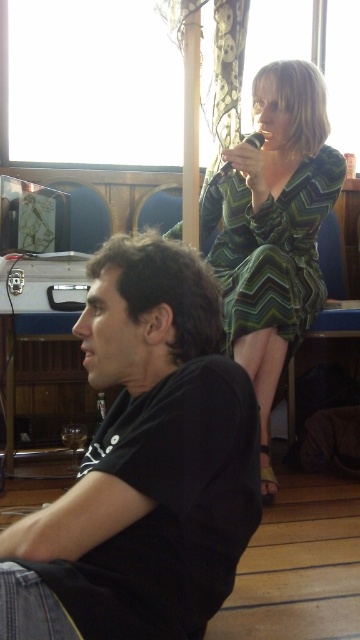
Is black matte shirt at lower left shorter than green zigzag dress at upper right?

Yes.

Who is positioned more to the right, black matte shirt at lower left or green zigzag dress at upper right?

From the viewer's perspective, green zigzag dress at upper right appears more on the right side.

Between point (18, 532) and point (234, 262), which one is positioned behind?

Positioned behind is point (234, 262).

You are a GUI agent. You are given a task and a screenshot of the screen. Output one action in this format:
    pyautogui.click(x=<x>, y=<y>)
    Task: Click on the black matte shirt at lower left
    This screenshot has height=640, width=360.
    Given the screenshot: What is the action you would take?
    pyautogui.click(x=151, y=456)